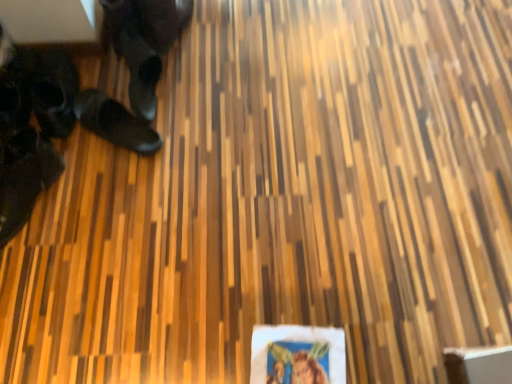
Question: Choose the correct answer: Is black leather shoes at left, which appears as the 2th footwear when viewed from the left, inside black leather shoe at lower left, the 3th footwear when ordered from right to left, or outside it?

Choices:
 (A) inside
 (B) outside

Answer: (B)

Question: Relative to black leather shoe at lower left, the 3th footwear when ordered from right to left, is black leather shoes at left, placed as the 2th footwear when sorted from right to left, in front or behind?

Choices:
 (A) front
 (B) behind

Answer: (B)

Question: Which is farther from the black rubber shoes at left, acting as the first footwear starting from the right?

Choices:
 (A) black leather shoes at left, which appears as the 2th footwear when viewed from the left
 (B) black leather shoe at lower left, the 3th footwear when ordered from right to left

Answer: (B)

Question: Estimate the real-world distances between objects in this image. Which object is closer to the black leather shoe at lower left, the 3th footwear when ordered from right to left?

Choices:
 (A) black leather shoes at left, which appears as the 2th footwear when viewed from the left
 (B) black rubber shoes at left, acting as the first footwear starting from the right

Answer: (A)